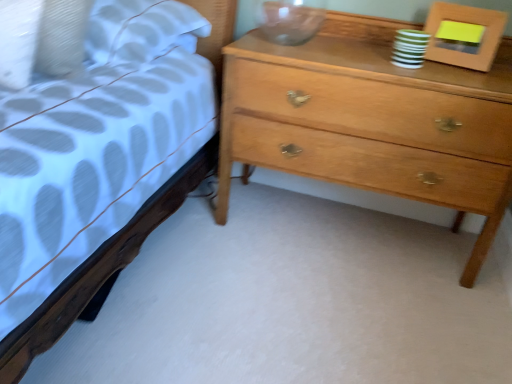
Question: Is point (501, 23) positioned closer to the camera than point (415, 192)?

Choices:
 (A) closer
 (B) farther

Answer: (A)

Question: In the image, is wooden picture frame at upper right positioned in front of or behind light brown wood chest of drawers at right?

Choices:
 (A) behind
 (B) front

Answer: (A)

Question: Considering the positions of wooden picture frame at upper right and light brown wood chest of drawers at right in the image, is wooden picture frame at upper right wider or thinner than light brown wood chest of drawers at right?

Choices:
 (A) wide
 (B) thin

Answer: (B)

Question: In the image, is light brown wood chest of drawers at right positioned in front of or behind wooden picture frame at upper right?

Choices:
 (A) front
 (B) behind

Answer: (A)

Question: Is light brown wood chest of drawers at right taller or shorter than wooden picture frame at upper right?

Choices:
 (A) tall
 (B) short

Answer: (A)

Question: Considering the positions of light brown wood chest of drawers at right and wooden picture frame at upper right in the image, is light brown wood chest of drawers at right bigger or smaller than wooden picture frame at upper right?

Choices:
 (A) big
 (B) small

Answer: (A)

Question: From the image's perspective, relative to wooden picture frame at upper right, is light brown wood chest of drawers at right above or below?

Choices:
 (A) below
 (B) above

Answer: (A)